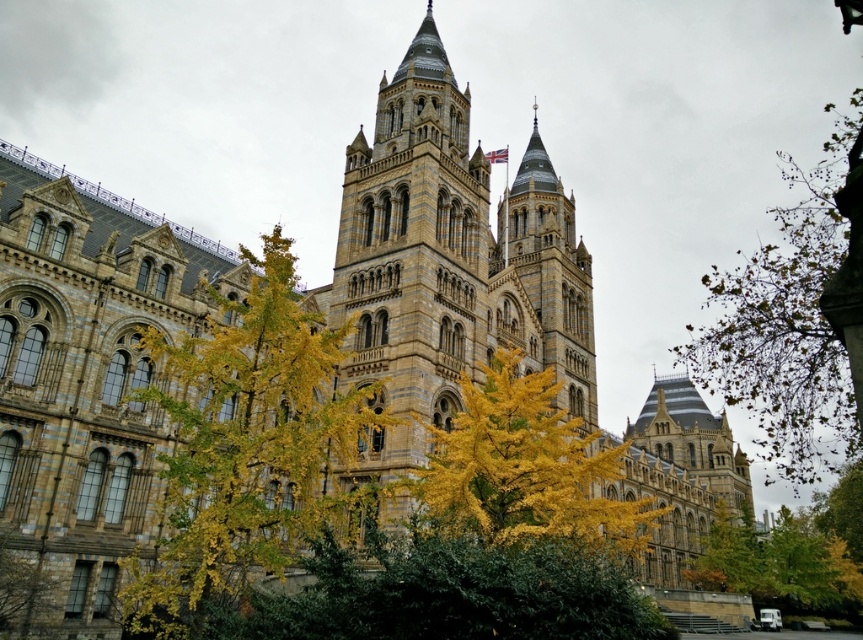
You are a landscape architect planning to install a pathway between the two yellow leafy trees. Given that the pathway requires a minimum of 30 meters of space between the trees to accommodate benches and walkways, can the existing distance between the yellow leafy tree at center and the yellow leafy tree at lower right support this project?

The yellow leafy tree at center and yellow leafy tree at lower right are 35.42 meters apart from each other. Since 35.42 meters exceeds the minimum required 30 meters, the existing distance can support the pathway project between them.

You are a landscape architect planning to plant a new tree between the green leafy tree at upper right and the yellow leafy tree at center. Given that the recommended spacing between trees is at least 100 feet for proper growth, is the existing distance sufficient for planting a new tree?

The green leafy tree at upper right and yellow leafy tree at center are 131.58 feet apart, which exceeds the minimum required spacing of 100 feet. Therefore, planting a new tree between them would be feasible as the existing distance is sufficient.

You are an architect examining the building and notice two trees, the yellow leafy tree at center and the yellow leafy tree at lower right. Which tree is taller?

The yellow leafy tree at center is taller than the yellow leafy tree at lower right according to the description.